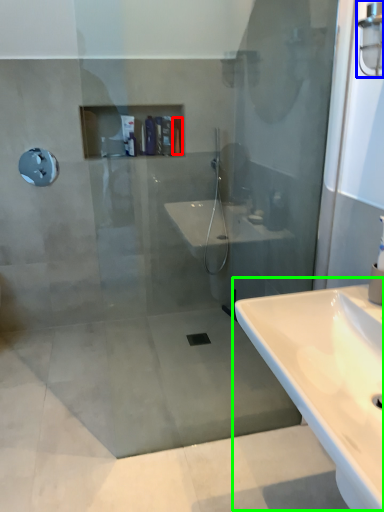
Question: Which object is positioned closest to toiletry (highlighted by a red box)? Select from light fixture (highlighted by a blue box) and sink (highlighted by a green box).

Choices:
 (A) light fixture
 (B) sink

Answer: (A)